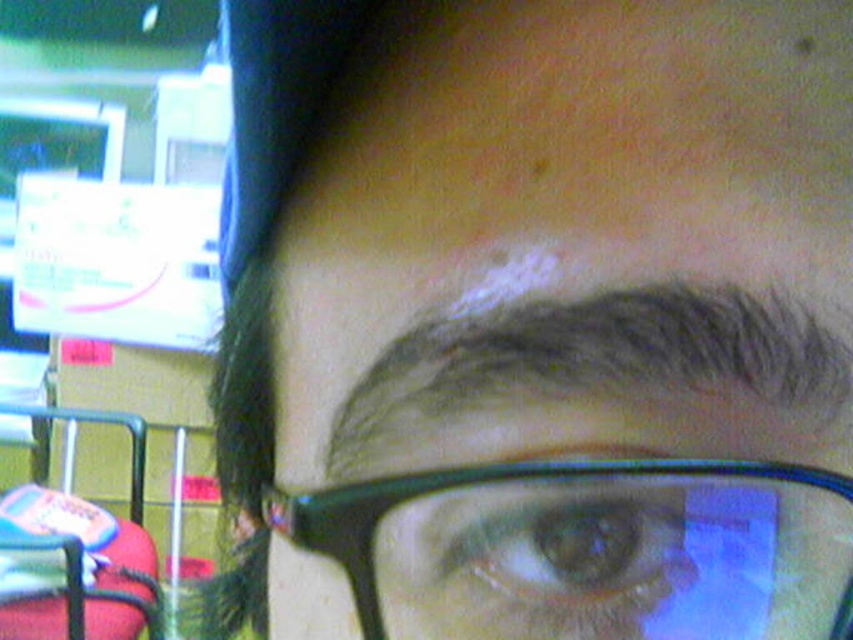
Question: Which point is farther to the camera?

Choices:
 (A) black plastic glasses at center
 (B) brown matte eye at center

Answer: (B)

Question: Which point is closer to the camera?

Choices:
 (A) brown matte eye at center
 (B) black plastic glasses at center

Answer: (B)

Question: Does black plastic glasses at center have a greater width compared to brown matte eye at center?

Choices:
 (A) no
 (B) yes

Answer: (B)

Question: Does black plastic glasses at center appear on the right side of brown matte eye at center?

Choices:
 (A) no
 (B) yes

Answer: (A)

Question: Among these objects, which one is nearest to the camera?

Choices:
 (A) black plastic glasses at center
 (B) brown matte eye at center

Answer: (A)

Question: Can you confirm if black plastic glasses at center is bigger than brown matte eye at center?

Choices:
 (A) yes
 (B) no

Answer: (A)